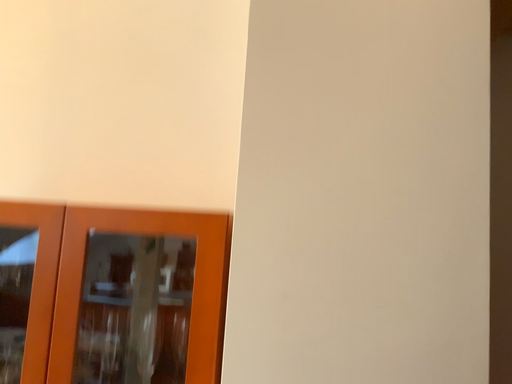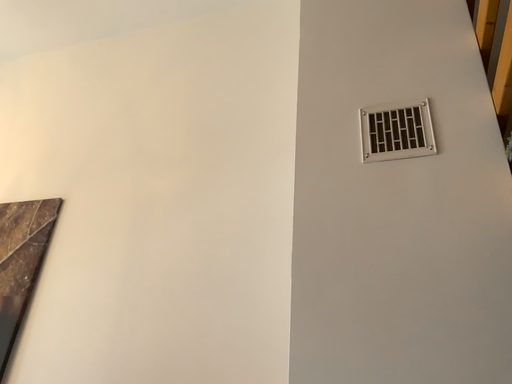
Question: Which way did the camera rotate in the video?

Choices:
 (A) rotated left
 (B) rotated right

Answer: (A)